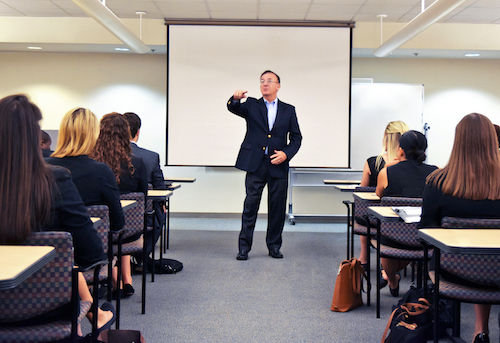
In order to click on chairs in this screenshot , I will do `click(466, 271)`, `click(399, 231)`, `click(363, 211)`, `click(149, 205)`, `click(132, 217)`, `click(104, 226)`, `click(60, 268)`.